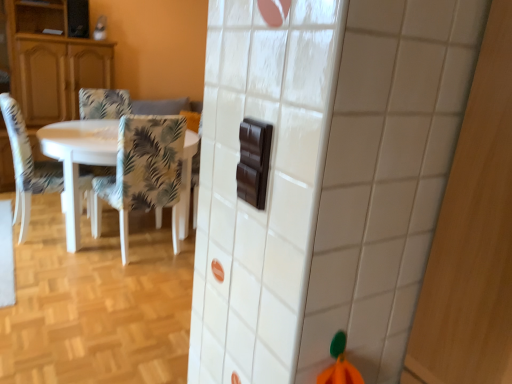
Question: Is floral fabric chair at left, placed as the 2th chair when sorted from left to right, wider or thinner than matte wood cabinet at left?

Choices:
 (A) thin
 (B) wide

Answer: (A)

Question: Based on their sizes in the image, would you say floral fabric chair at left, the 2th chair in the right-to-left sequence, is bigger or smaller than matte wood cabinet at left?

Choices:
 (A) big
 (B) small

Answer: (B)

Question: Which of these objects is positioned closest to the patterned fabric chair at left, which is the third chair in right-to-left order?

Choices:
 (A) matte wood cabinet at left
 (B) patterned fabric chair at left, the third chair viewed from the left
 (C) floral fabric chair at left, placed as the 2th chair when sorted from left to right
 (D) white glossy table at left

Answer: (D)

Question: Considering the real-world distances, which object is closest to the matte wood cabinet at left?

Choices:
 (A) floral fabric chair at left, placed as the 2th chair when sorted from left to right
 (B) patterned fabric chair at left, acting as the first chair starting from the right
 (C) patterned fabric chair at left, the 1th chair in the left-to-right sequence
 (D) white glossy table at left

Answer: (A)